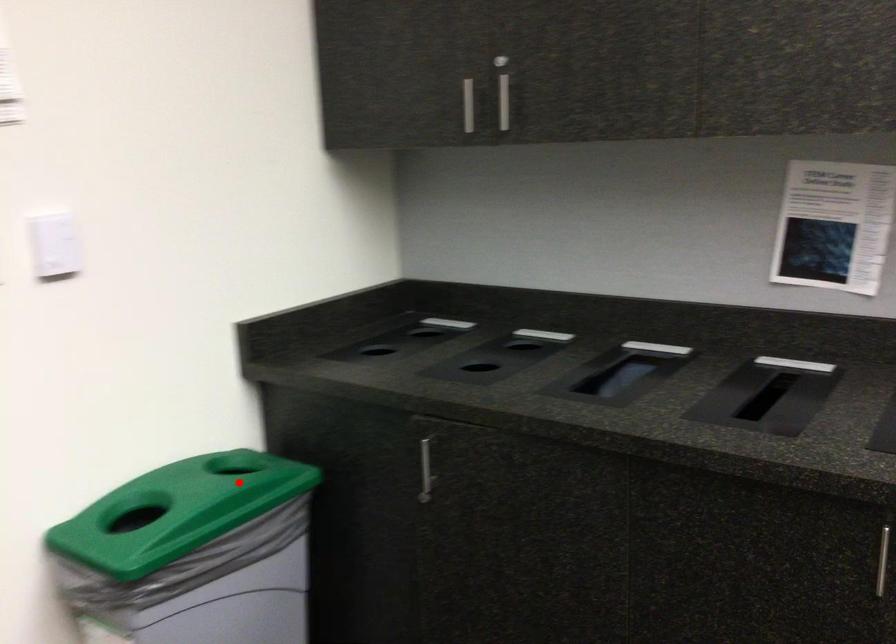
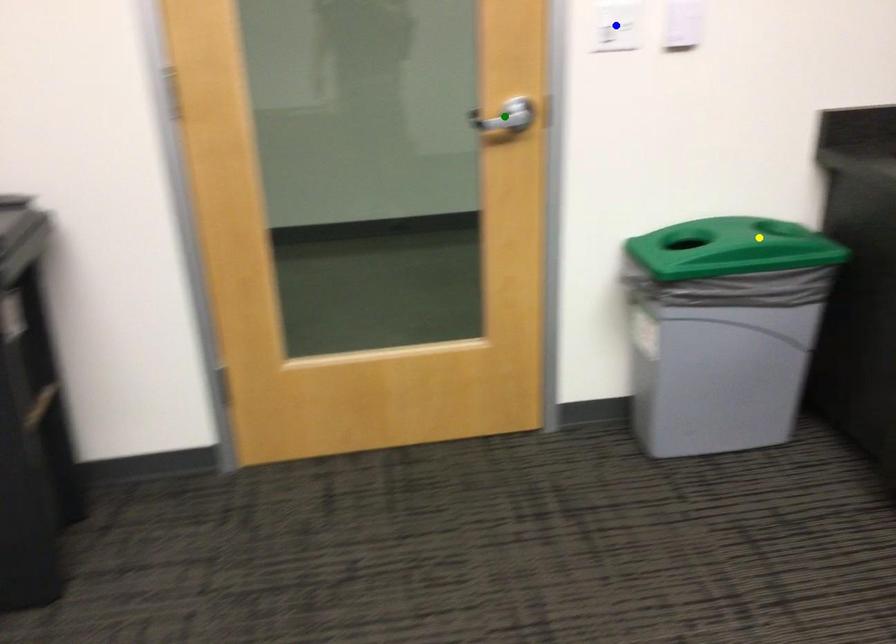
Question: I am providing you with two images of the same scene from different viewpoints. A red point is marked on the first image. You are given multiple points on the second image. Can you choose the point in image 2 that corresponds to the point in image 1?

Choices:
 (A) yellow point
 (B) green point
 (C) blue point

Answer: (A)